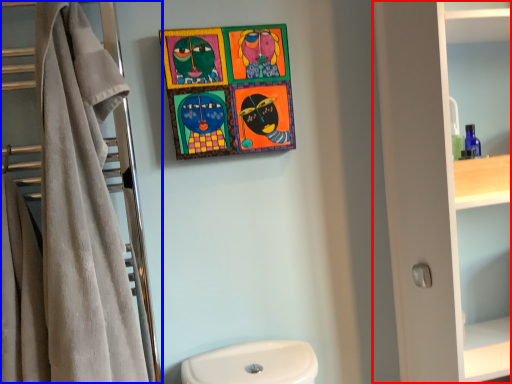
Question: Among these objects, which one is nearest to the camera, bathroom cabinet (highlighted by a red box) or closet (highlighted by a blue box)?

Choices:
 (A) bathroom cabinet
 (B) closet

Answer: (B)